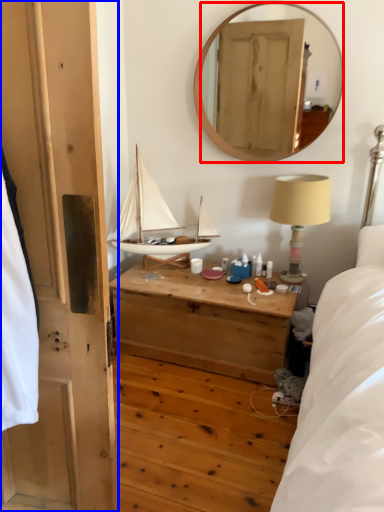
Question: Among these objects, which one is nearest to the camera, mirror (highlighted by a red box) or door (highlighted by a blue box)?

Choices:
 (A) mirror
 (B) door

Answer: (B)